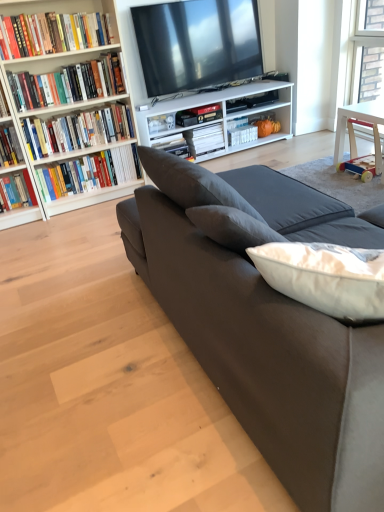
Find the location of a particular element. Image resolution: width=384 pixels, height=512 pixels. free space above hardcover book at left, the 3th book viewed from the front (from a real-world perspective) is located at coordinates (61, 109).